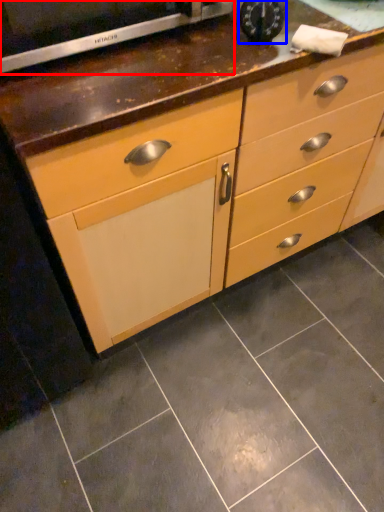
Question: Which object is further to the camera taking this photo, appliance (highlighted by a red box) or appliance (highlighted by a blue box)?

Choices:
 (A) appliance
 (B) appliance

Answer: (B)